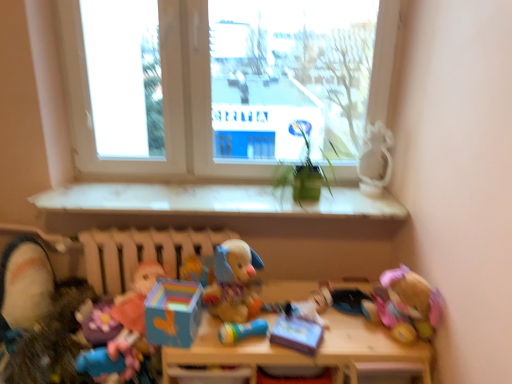
In order to click on free point below transparent glass window at upper center, the 1th window screen viewed from the left (from a real-world perspective) in this screenshot , I will do `click(134, 182)`.